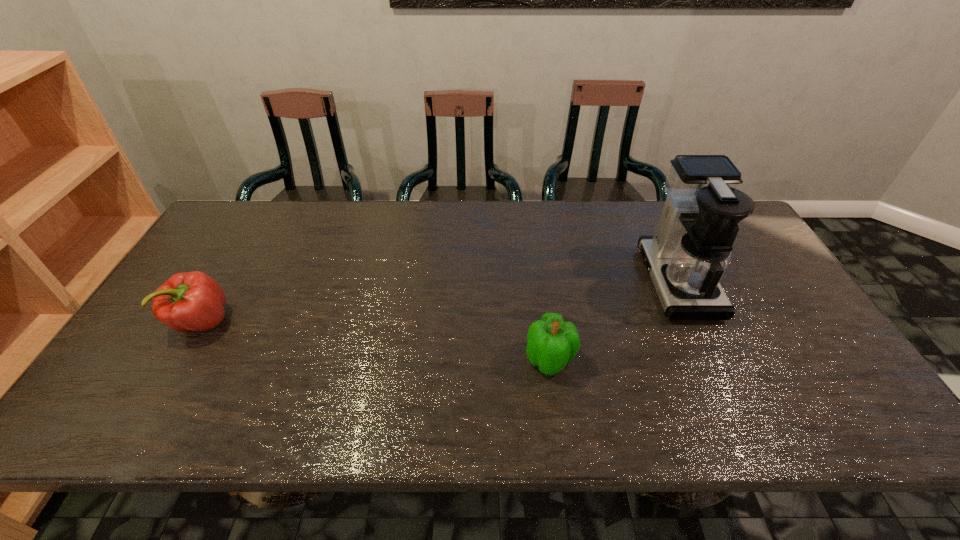
The height and width of the screenshot is (540, 960). In the image, there is a desktop. What are the coordinates of `vacant space at the far edge` in the screenshot? It's located at (616, 234).

Where is `vacant space at the near edge of the desktop`? vacant space at the near edge of the desktop is located at coordinates (336, 406).

The height and width of the screenshot is (540, 960). What are the coordinates of `free region at the left edge of the desktop` in the screenshot? It's located at (187, 352).

You are a GUI agent. You are given a task and a screenshot of the screen. Output one action in this format:
    pyautogui.click(x=<x>, y=<y>)
    Task: Click on the vacant space at the right edge
    
    Given the screenshot: What is the action you would take?
    pyautogui.click(x=790, y=301)

In the image, there is a desktop. What are the coordinates of `free region at the far left corner` in the screenshot? It's located at (230, 244).

You are a GUI agent. You are given a task and a screenshot of the screen. Output one action in this format:
    pyautogui.click(x=<x>, y=<y>)
    Task: Click on the unoccupied position between the leftmost object and the rightmost object
    
    Given the screenshot: What is the action you would take?
    (x=440, y=302)

You are a GUI agent. You are given a task and a screenshot of the screen. Output one action in this format:
    pyautogui.click(x=<x>, y=<y>)
    Task: Click on the vacant point located between the coffee maker and the second object from right to left
    
    Given the screenshot: What is the action you would take?
    pyautogui.click(x=613, y=321)

Find the location of a particular element. The image size is (960, 540). free space between the leftmost object and the second object from left to right is located at coordinates (375, 341).

Find the location of a particular element. This screenshot has height=540, width=960. free area in between the left bell pepper and the right bell pepper is located at coordinates [x=375, y=341].

Find the location of a particular element. free spot between the left bell pepper and the right bell pepper is located at coordinates (375, 341).